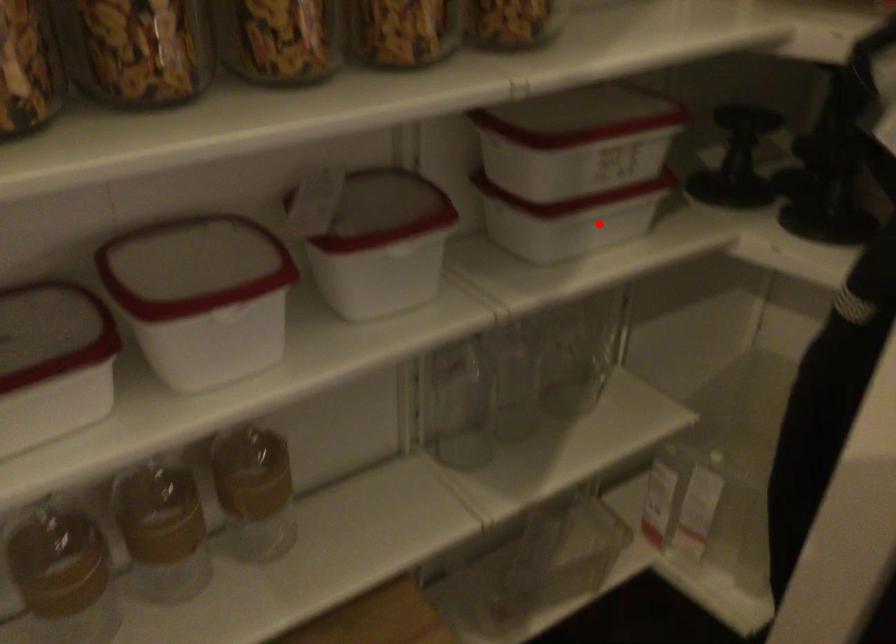
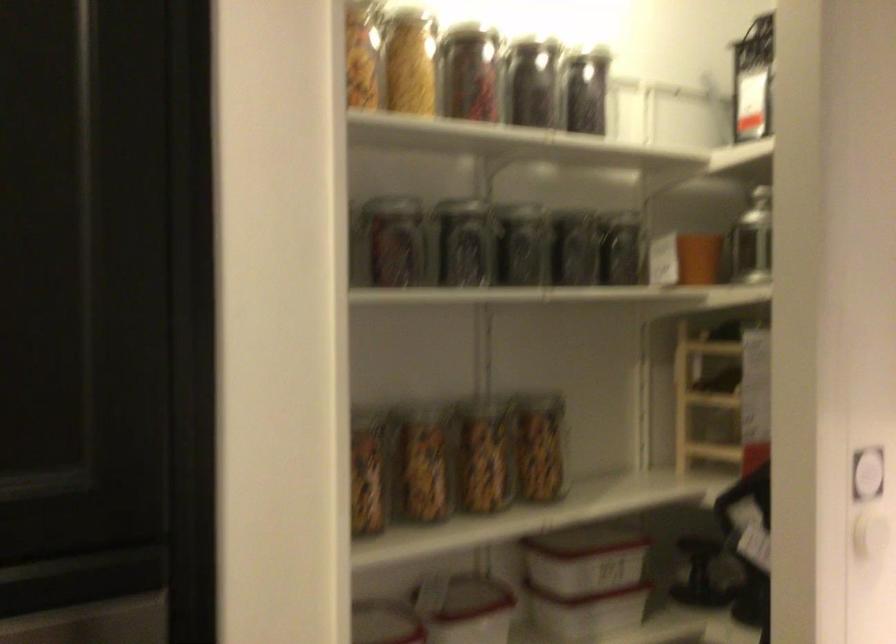
Question: I am providing you with two images of the same scene from different viewpoints. Given a red point in image1, look at the same physical point in image2. Is it:

Choices:
 (A) Closer to the viewpoint
 (B) Farther from the viewpoint

Answer: (B)